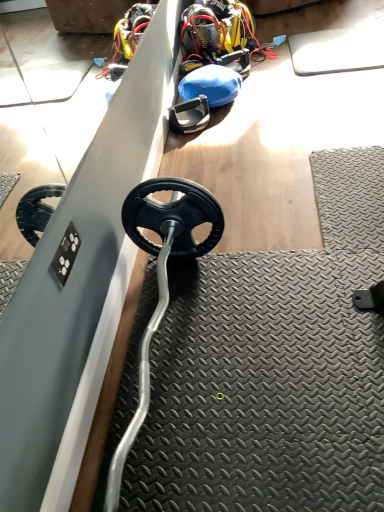
In order to click on vacant area that lies to the right of black rubber wheel at center in this screenshot , I will do `click(230, 121)`.